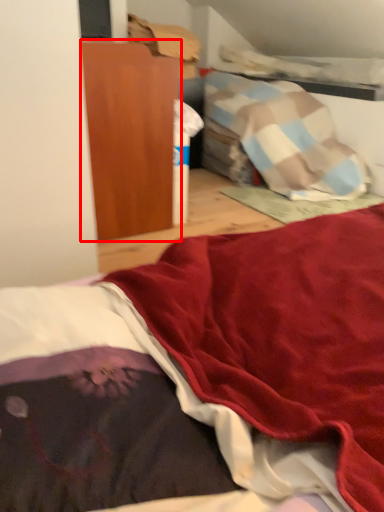
Question: Considering the relative positions of furniture (annotated by the red box) and bed in the image provided, where is furniture (annotated by the red box) located with respect to the staircase?

Choices:
 (A) left
 (B) right

Answer: (A)